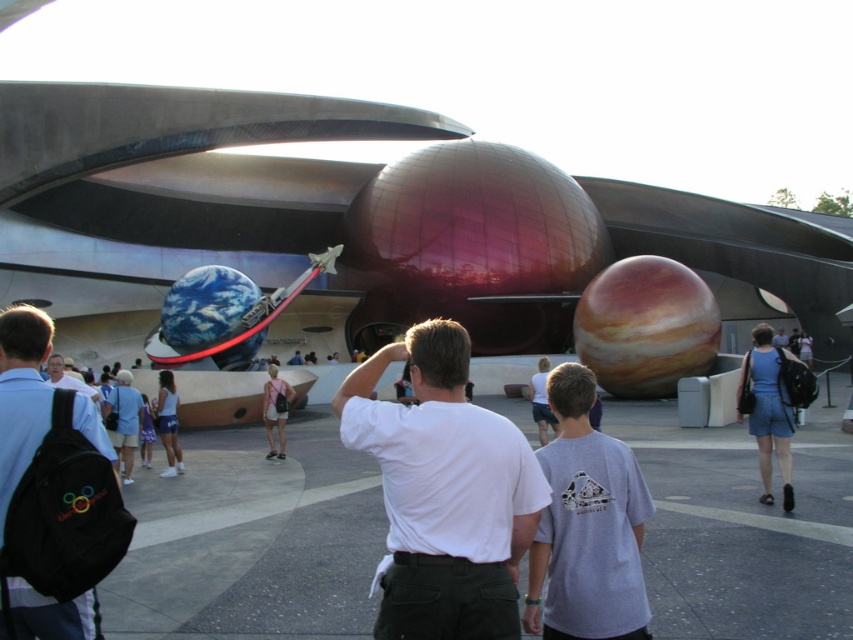
Question: Which point is farther to the camera?

Choices:
 (A) (57, 376)
 (B) (384, 355)

Answer: (A)

Question: Which of the following is the farthest from the observer?

Choices:
 (A) (396, 614)
 (B) (56, 356)

Answer: (B)

Question: Is white cotton shirt at center thinner than light blue shirt at center?

Choices:
 (A) no
 (B) yes

Answer: (B)

Question: Based on their relative distances, which object is nearer to the black fabric backpack at left?

Choices:
 (A) white cotton shirt at center
 (B) light blue shirt at center

Answer: (B)

Question: Is black fabric backpack at left behind light blue shirt at center?

Choices:
 (A) yes
 (B) no

Answer: (B)

Question: Is white cotton shirt at center positioned in front of light blue shirt at center?

Choices:
 (A) no
 (B) yes

Answer: (B)